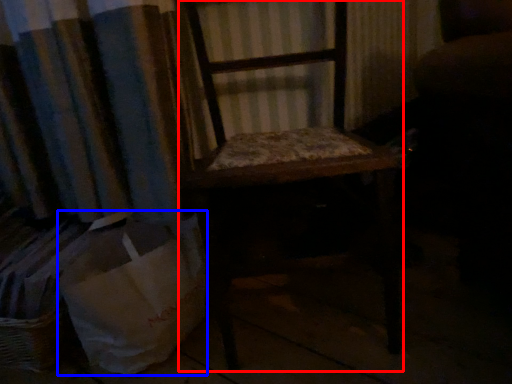
Question: Which object appears farthest to the camera in this image, furniture (highlighted by a red box) or shopping bag (highlighted by a blue box)?

Choices:
 (A) furniture
 (B) shopping bag

Answer: (B)